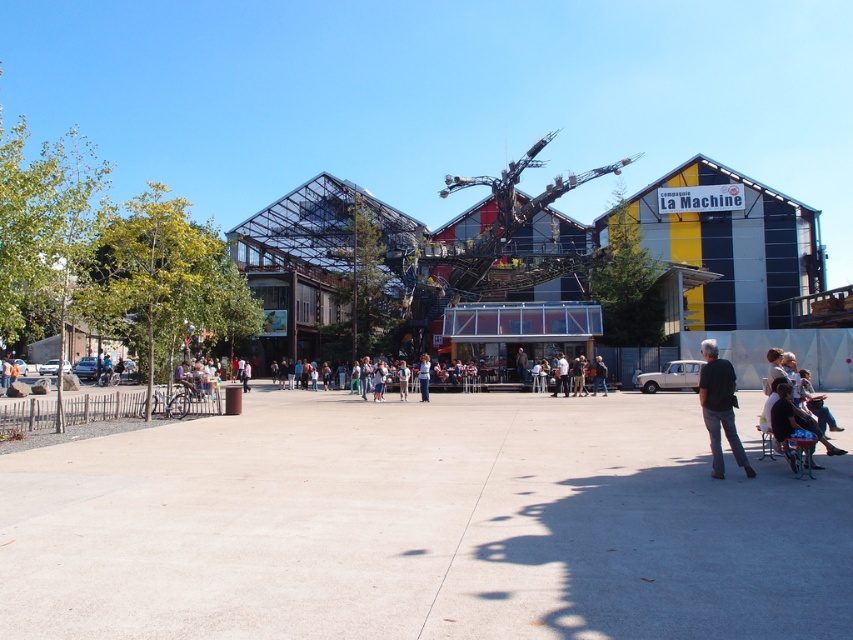
Question: Which point is closer to the camera?

Choices:
 (A) green plastic baby carriage at lower right
 (B) concrete at center

Answer: (B)

Question: Is metallic structure at center further to camera compared to black fabric pants at lower right?

Choices:
 (A) no
 (B) yes

Answer: (B)

Question: Which point appears closest to the camera in this image?

Choices:
 (A) (721, 364)
 (B) (440, 424)

Answer: (A)

Question: Which point is closer to the camera taking this photo?

Choices:
 (A) pos(808,456)
 (B) pos(724,401)

Answer: (B)

Question: Can you confirm if metallic structure at center is positioned above black fabric pants at lower right?

Choices:
 (A) yes
 (B) no

Answer: (A)

Question: Does concrete at center have a smaller size compared to white fabric shirt at center?

Choices:
 (A) yes
 (B) no

Answer: (B)